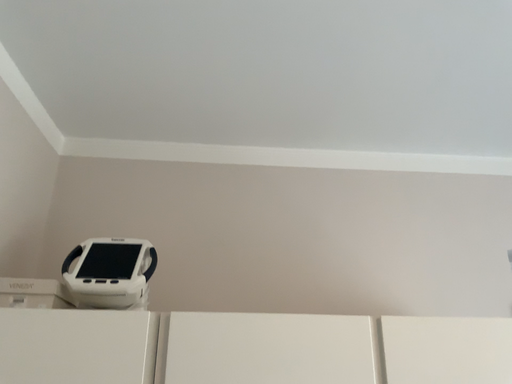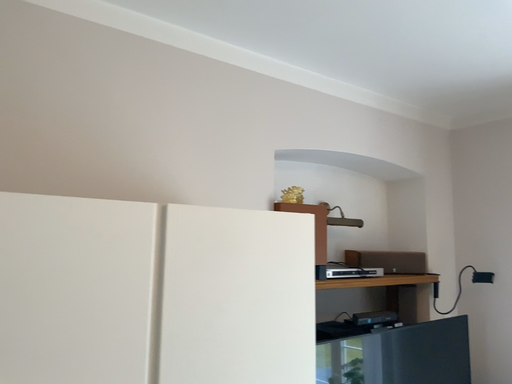
Question: How did the camera likely rotate when shooting the video?

Choices:
 (A) rotated right
 (B) rotated left

Answer: (A)